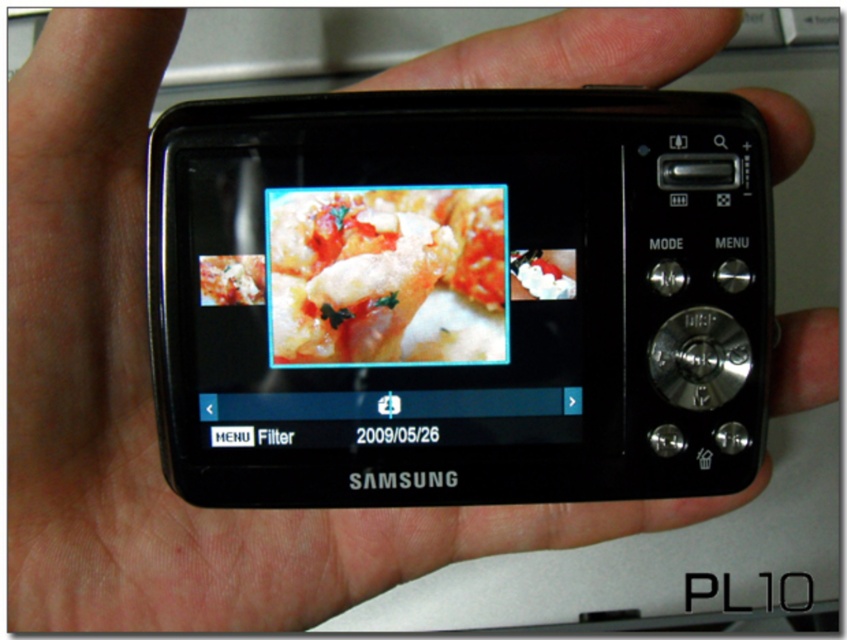
Question: Is the position of black glossy screen at center less distant than that of shiny tomato sauce at center?

Choices:
 (A) no
 (B) yes

Answer: (B)

Question: Is black glossy screen at center thinner than shiny tomato sauce at center?

Choices:
 (A) no
 (B) yes

Answer: (A)

Question: Which object is closer to the camera taking this photo?

Choices:
 (A) shiny tomato sauce at center
 (B) black glossy screen at center

Answer: (B)

Question: In this image, where is black glossy screen at center located relative to shiny tomato sauce at center?

Choices:
 (A) below
 (B) above

Answer: (A)